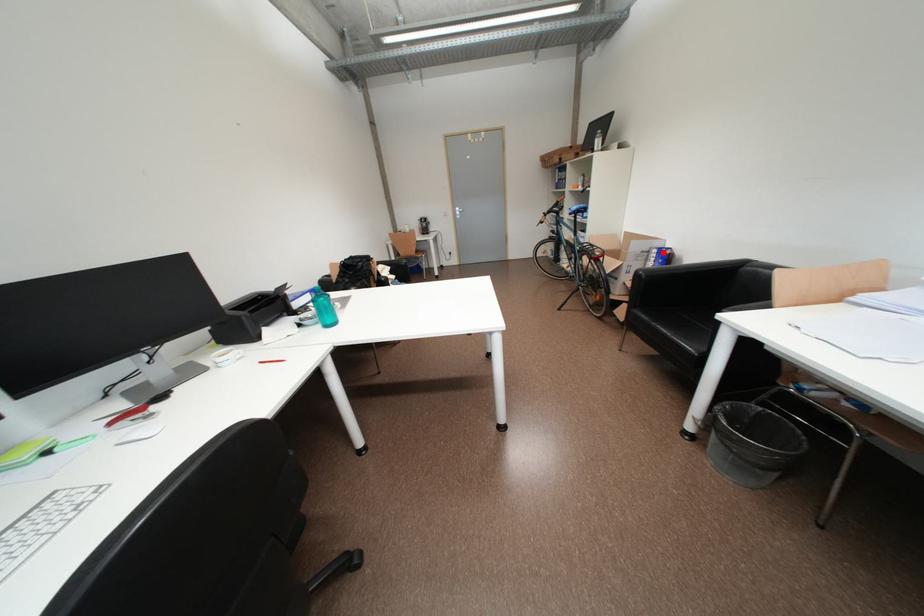
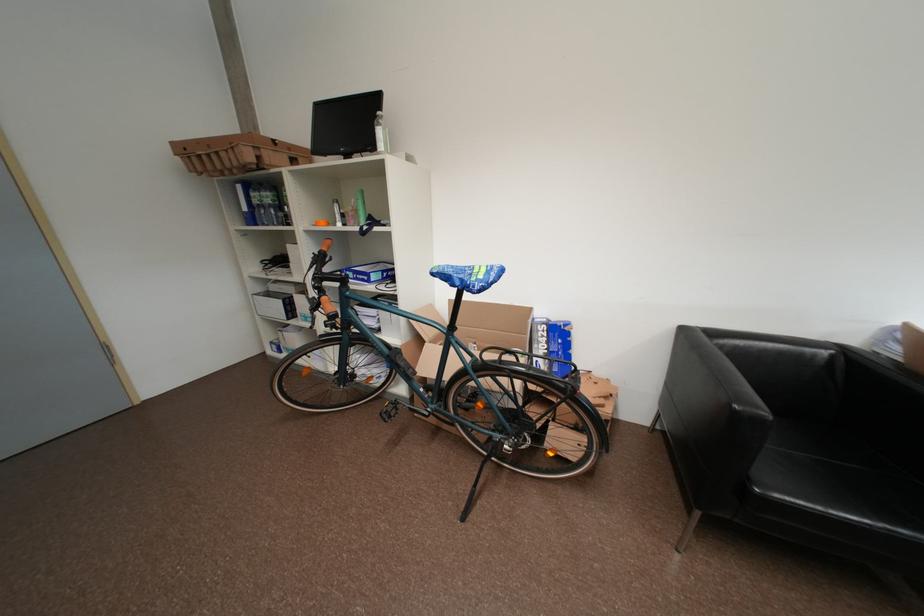
Question: A red point is marked in image1. In image2, is the corresponding 3D point closer to the camera or farther? Reply with the corresponding letter.

Choices:
 (A) The corresponding 3D point is closer.
 (B) The corresponding 3D point is farther.

Answer: (B)